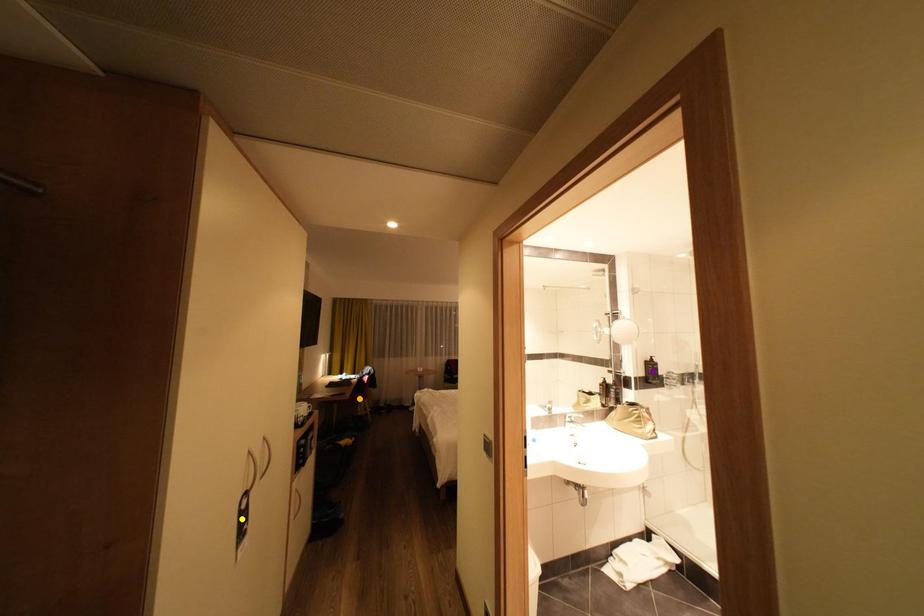
Order these from nearest to farthest:
- purple point
- orange point
- yellow point

yellow point → purple point → orange point